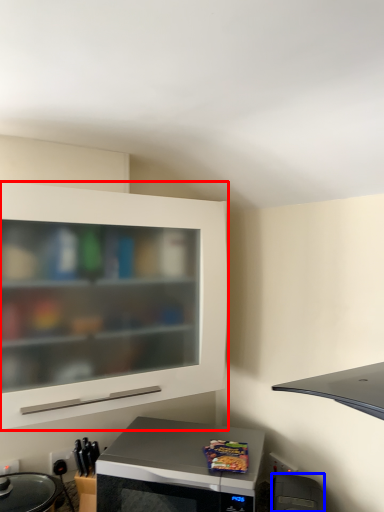
Question: Which object appears farthest to the camera in this image, cabinetry (highlighted by a red box) or appliance (highlighted by a blue box)?

Choices:
 (A) cabinetry
 (B) appliance

Answer: (A)